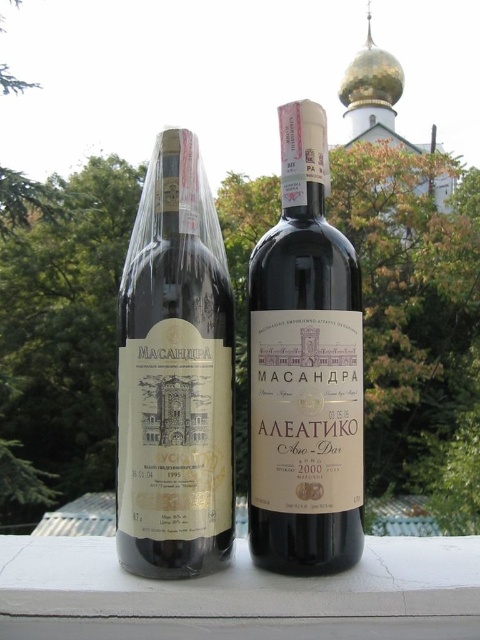
You are a delivery person carrying a box that is 10 inches wide. You need to place it on the surface between the matte paper wine bottle at center and the white painted concrete at center. Can the box fit between them without overlapping either object?

The matte paper wine bottle at center is narrower than the white painted concrete at center. Since the box is 10 inches wide and the space between them is determined by the narrower object, the box may not fit if the available width is less than 10 inches. However, without exact measurements, we cannot confirm. Please check the actual space.

You are a delivery person who needs to place a third wine bottle between the two existing ones on the ledge. The third bottle is 3 inches in diameter. Can you fit it between the matte paper wine bottle at center and the other bottle? Please explain your reasoning.

The two wine bottles are 21.17 inches apart. Since the third bottle is only 3 inches in diameter, there is sufficient space between the matte paper wine bottle at center and the other bottle to fit it comfortably.